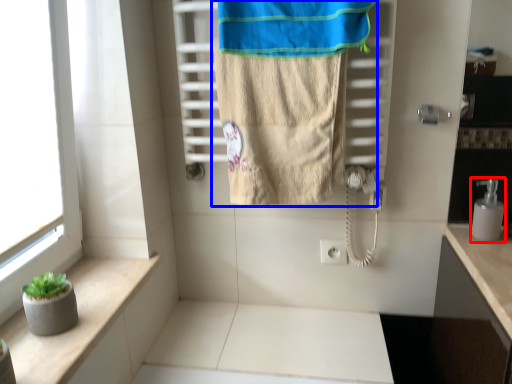
Question: Which object is closer to the camera taking this photo, soap dispenser (highlighted by a red box) or towel (highlighted by a blue box)?

Choices:
 (A) soap dispenser
 (B) towel

Answer: (B)